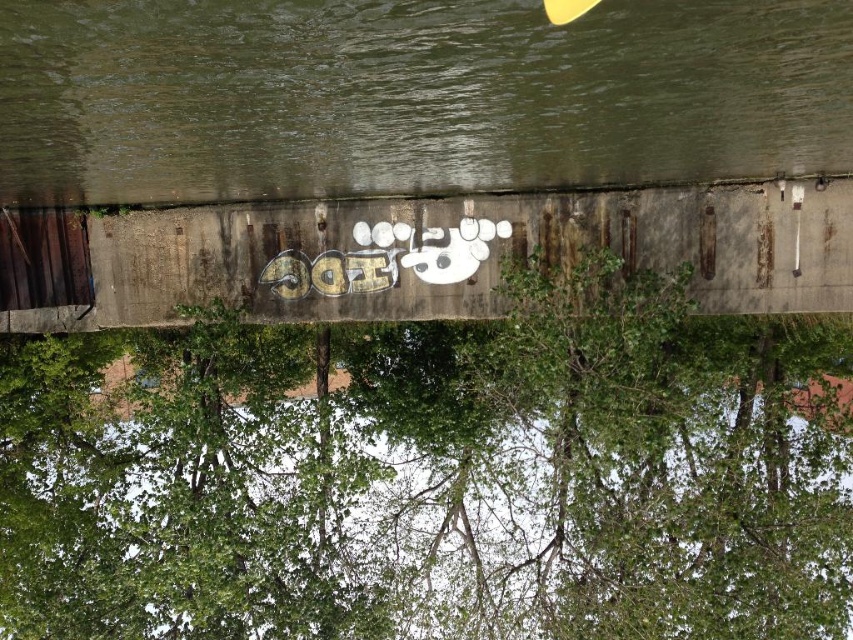
You are a bird flying over the scene. You see the green leafy tree at center and the green concrete river at center. Which one is closer to the ground?

The green leafy tree at center is below the green concrete river at center, so it is closer to the ground.

In the scene shown: You are a painter who wants to paint a scene that includes both the green leafy tree at center and the green concrete river at center. Which object should you paint first if you follow the rule of painting wider objects before narrower ones?

The green leafy tree at center should be painted first because its width surpasses the green concrete river at center, so wider objects should be painted before narrower ones.